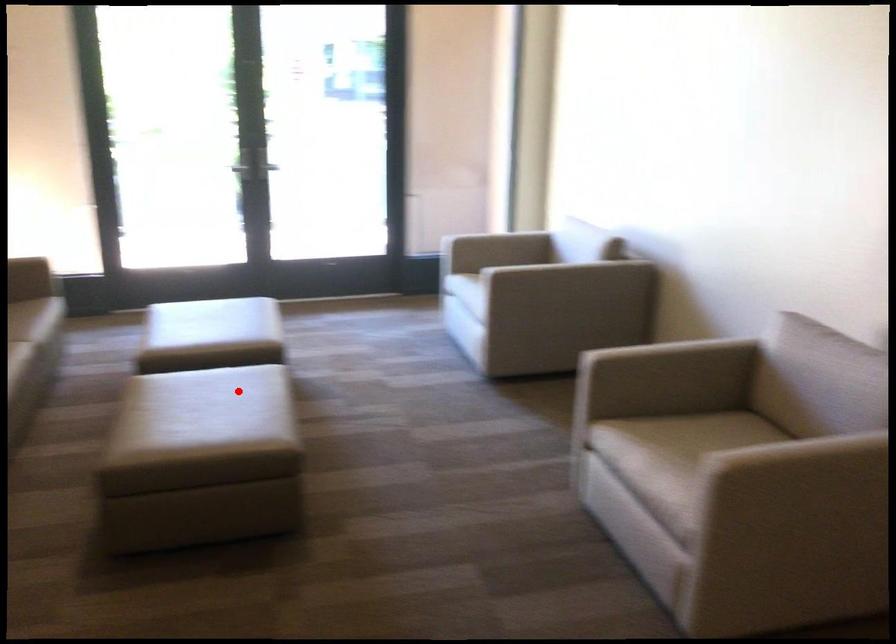
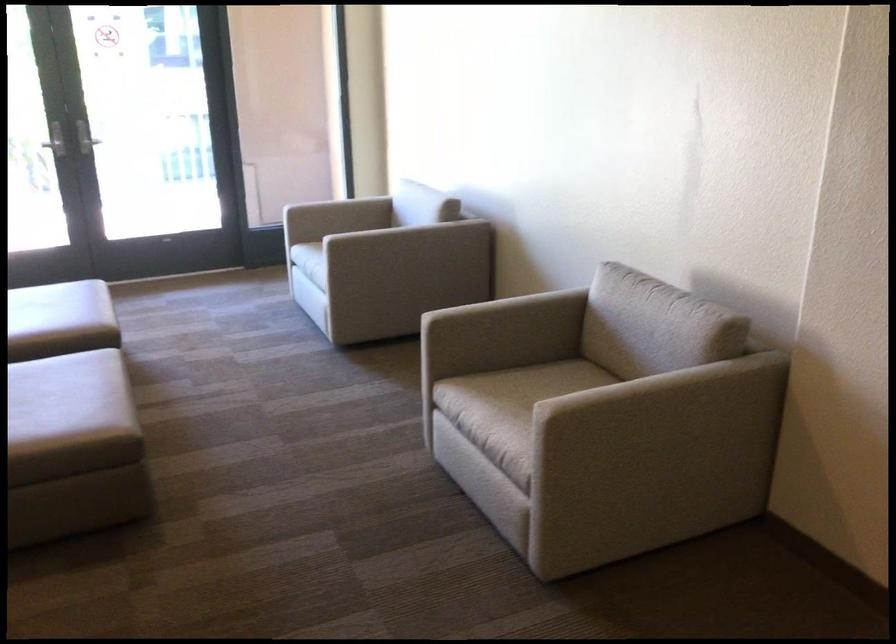
Locate, in the second image, the point that corresponds to the highlighted location in the first image.

(65, 384)